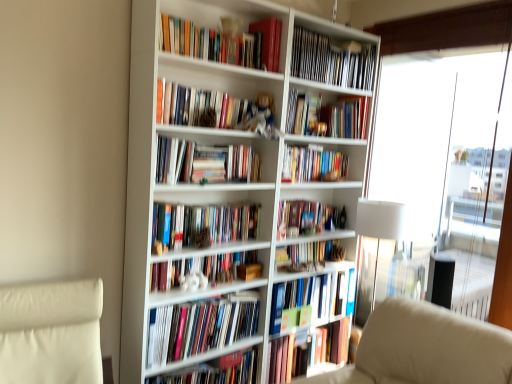
Question: In terms of size, does transparent glass window at right appear bigger or smaller than hardcover book at center, which ranks as the second paperback book in top-to-bottom order?

Choices:
 (A) big
 (B) small

Answer: (A)

Question: Do you think transparent glass window at right is within hardcover book at center, the first paperback book in the bottom-to-top sequence, or outside of it?

Choices:
 (A) inside
 (B) outside

Answer: (B)

Question: Estimate the real-world distances between objects in this image. Which object is closer to the hardcover books at center, acting as the eleventh book starting from the top?

Choices:
 (A) hardcover book at center, which is the 13th book from top to bottom
 (B) hardcover book at center, positioned as the 8th book in top-to-bottom order
 (C) white matte bookcase at center
 (D) matte plastic books at upper right, which is the twelfth book in bottom-to-top order
 (E) white fabric lampshade at right

Answer: (A)

Question: Considering the real-world distances, which object is closest to the transparent glass window at right?

Choices:
 (A) matte plastic books at upper right, which is the twelfth book in bottom-to-top order
 (B) hardcover books at center, acting as the sixth book starting from the top
 (C) white leather swivel chair at lower left
 (D) white matte bookcase at center
 (E) white fabric lampshade at right

Answer: (E)